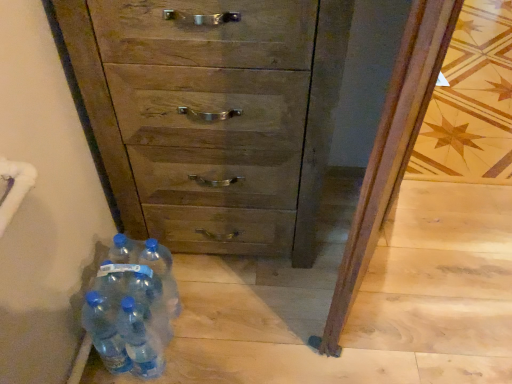
What do you see at coordinates (212, 92) in the screenshot? The image size is (512, 384). I see `wooden chest of drawers at center` at bounding box center [212, 92].

The height and width of the screenshot is (384, 512). What do you see at coordinates (150, 300) in the screenshot? I see `transparent plastic bottles at lower left, the fourth bottle viewed from the left` at bounding box center [150, 300].

In order to face translucent plastic water bottles at lower left, acting as the fifth bottle starting from the right, should I rotate leftwards or rightwards?

You should rotate left by 19.321 degrees.

Describe the element at coordinates (105, 333) in the screenshot. The image size is (512, 384). I see `translucent plastic water bottles at lower left, acting as the fifth bottle starting from the right` at that location.

How much space does blue plastic bottles at lower left, the 4th bottle in the right-to-left sequence, occupy horizontally?

The width of blue plastic bottles at lower left, the 4th bottle in the right-to-left sequence, is 3.86 inches.

The image size is (512, 384). Identify the location of blue plastic bottles at lower left, marked as the 2th bottle in a left-to-right arrangement. (133, 312).

You are a GUI agent. You are given a task and a screenshot of the screen. Output one action in this format:
    pyautogui.click(x=<x>, y=<y>)
    Task: Click on the transparent plastic bottles at lower left, arranged as the third bottle when viewed from the left
    This screenshot has height=384, width=512.
    Given the screenshot: What is the action you would take?
    coord(140,339)

The width and height of the screenshot is (512, 384). I want to click on wooden chest of drawers at center, so (x=212, y=92).

Could you tell me if wooden chest of drawers at center is facing blue plastic bottles at lower left, the 4th bottle in the right-to-left sequence?

Yes, wooden chest of drawers at center is turned towards blue plastic bottles at lower left, the 4th bottle in the right-to-left sequence.

Considering the positions of points (193, 201) and (133, 294), is point (193, 201) closer to camera compared to point (133, 294)?

That is False.

From the image's perspective, is wooden chest of drawers at center on top of blue plastic bottles at lower left, the 4th bottle in the right-to-left sequence?

Yes, from the image's perspective, wooden chest of drawers at center is on top of blue plastic bottles at lower left, the 4th bottle in the right-to-left sequence.

Which of these two, blue plastic bottles at lower left, marked as the 2th bottle in a left-to-right arrangement, or blue translucent bottle at lower left, acting as the 1th bottle starting from the right, is smaller?

Smaller between the two is blue translucent bottle at lower left, acting as the 1th bottle starting from the right.

Between blue plastic bottles at lower left, the 4th bottle in the right-to-left sequence, and blue translucent bottle at lower left, acting as the 1th bottle starting from the right, which one appears on the right side from the viewer's perspective?

Positioned to the right is blue translucent bottle at lower left, acting as the 1th bottle starting from the right.

Is blue plastic bottles at lower left, marked as the 2th bottle in a left-to-right arrangement, looking in the opposite direction of blue translucent bottle at lower left, the fifth bottle positioned from the left?

That's not correct — blue plastic bottles at lower left, marked as the 2th bottle in a left-to-right arrangement, is not looking away from blue translucent bottle at lower left, the fifth bottle positioned from the left.

Is blue plastic bottles at lower left, the 4th bottle in the right-to-left sequence, taller than blue translucent bottle at lower left, the fifth bottle positioned from the left?

Indeed, blue plastic bottles at lower left, the 4th bottle in the right-to-left sequence, has a greater height compared to blue translucent bottle at lower left, the fifth bottle positioned from the left.

From a real-world perspective, is blue translucent bottle at lower left, the fifth bottle positioned from the left, physically above wooden chest of drawers at center?

No.

From the image's perspective, is blue translucent bottle at lower left, the fifth bottle positioned from the left, positioned above or below wooden chest of drawers at center?

Clearly, from the image's perspective, blue translucent bottle at lower left, the fifth bottle positioned from the left, is below wooden chest of drawers at center.

Does point (161, 251) come farther from viewer compared to point (101, 116)?

Yes, it is behind point (101, 116).

Considering the positions of objects blue translucent bottle at lower left, the fifth bottle positioned from the left, and wooden chest of drawers at center in the image provided, who is more to the left, blue translucent bottle at lower left, the fifth bottle positioned from the left, or wooden chest of drawers at center?

Positioned to the left is blue translucent bottle at lower left, the fifth bottle positioned from the left.

Is translucent plastic water bottles at lower left, the first bottle when ordered from left to right, positioned with its back to transparent plastic bottles at lower left, arranged as the third bottle when viewed from the left?

Yes, translucent plastic water bottles at lower left, the first bottle when ordered from left to right, is positioned with its back facing transparent plastic bottles at lower left, arranged as the third bottle when viewed from the left.

Consider the image. Between translucent plastic water bottles at lower left, the first bottle when ordered from left to right, and transparent plastic bottles at lower left, acting as the 3th bottle starting from the right, which one has smaller size?

Smaller between the two is translucent plastic water bottles at lower left, the first bottle when ordered from left to right.

Can you confirm if translucent plastic water bottles at lower left, the first bottle when ordered from left to right, is shorter than transparent plastic bottles at lower left, arranged as the third bottle when viewed from the left?

Yes, translucent plastic water bottles at lower left, the first bottle when ordered from left to right, is shorter than transparent plastic bottles at lower left, arranged as the third bottle when viewed from the left.

Is the surface of blue plastic bottles at lower left, marked as the 2th bottle in a left-to-right arrangement, in direct contact with wooden chest of drawers at center?

No, blue plastic bottles at lower left, marked as the 2th bottle in a left-to-right arrangement, is not touching wooden chest of drawers at center.

From a real-world perspective, does blue plastic bottles at lower left, the 4th bottle in the right-to-left sequence, sit lower than wooden chest of drawers at center?

Indeed, from a real-world perspective, blue plastic bottles at lower left, the 4th bottle in the right-to-left sequence, is positioned beneath wooden chest of drawers at center.

Considering the relative sizes of blue plastic bottles at lower left, the 4th bottle in the right-to-left sequence, and wooden chest of drawers at center in the image provided, is blue plastic bottles at lower left, the 4th bottle in the right-to-left sequence, wider than wooden chest of drawers at center?

No, blue plastic bottles at lower left, the 4th bottle in the right-to-left sequence, is not wider than wooden chest of drawers at center.

From the image's perspective, does blue plastic bottles at lower left, marked as the 2th bottle in a left-to-right arrangement, appear higher than wooden chest of drawers at center?

Incorrect, from the image's perspective, blue plastic bottles at lower left, marked as the 2th bottle in a left-to-right arrangement, is lower than wooden chest of drawers at center.

Consider the image. Does transparent plastic bottles at lower left, arranged as the third bottle when viewed from the left, lie behind blue translucent bottle at lower left, the fifth bottle positioned from the left?

That is False.

Is transparent plastic bottles at lower left, arranged as the third bottle when viewed from the left, bigger or smaller than blue translucent bottle at lower left, acting as the 1th bottle starting from the right?

Clearly, transparent plastic bottles at lower left, arranged as the third bottle when viewed from the left, is smaller in size than blue translucent bottle at lower left, acting as the 1th bottle starting from the right.

Is transparent plastic bottles at lower left, acting as the 3th bottle starting from the right, wider or thinner than blue translucent bottle at lower left, the fifth bottle positioned from the left?

transparent plastic bottles at lower left, acting as the 3th bottle starting from the right, is thinner than blue translucent bottle at lower left, the fifth bottle positioned from the left.

Is transparent plastic bottles at lower left, acting as the 3th bottle starting from the right, aimed at blue translucent bottle at lower left, the fifth bottle positioned from the left?

No, transparent plastic bottles at lower left, acting as the 3th bottle starting from the right, does not turn towards blue translucent bottle at lower left, the fifth bottle positioned from the left.

Is blue plastic bottles at lower left, the 4th bottle in the right-to-left sequence, positioned beyond the bounds of translucent plastic water bottles at lower left, acting as the fifth bottle starting from the right?

blue plastic bottles at lower left, the 4th bottle in the right-to-left sequence, is positioned outside translucent plastic water bottles at lower left, acting as the fifth bottle starting from the right.

Considering the positions of objects blue plastic bottles at lower left, marked as the 2th bottle in a left-to-right arrangement, and translucent plastic water bottles at lower left, acting as the fifth bottle starting from the right, in the image provided, who is more to the left, blue plastic bottles at lower left, marked as the 2th bottle in a left-to-right arrangement, or translucent plastic water bottles at lower left, acting as the fifth bottle starting from the right,?

Positioned to the left is translucent plastic water bottles at lower left, acting as the fifth bottle starting from the right.

Does point (170, 329) come closer to viewer compared to point (102, 338)?

No, (170, 329) is further to viewer.

Locate an element on the screen. The width and height of the screenshot is (512, 384). chest of drawers to the right of blue plastic bottles at lower left, the 4th bottle in the right-to-left sequence is located at coordinates (212, 92).

From the image's perspective, which bottle is the 1st one below the blue translucent bottle at lower left, the fifth bottle positioned from the left? Please provide its 2D coordinates.

[(133, 312)]

Which object lies further to the anchor point blue plastic bottles at lower left, marked as the 2th bottle in a left-to-right arrangement, translucent plastic water bottles at lower left, acting as the fifth bottle starting from the right, or transparent plastic bottles at lower left, the second bottle viewed from the right?

translucent plastic water bottles at lower left, acting as the fifth bottle starting from the right, lies further to blue plastic bottles at lower left, marked as the 2th bottle in a left-to-right arrangement, than the other object.

Considering their positions, is blue plastic bottles at lower left, the 4th bottle in the right-to-left sequence, positioned closer to blue translucent bottle at lower left, the fifth bottle positioned from the left, than transparent plastic bottles at lower left, the fourth bottle viewed from the left?

transparent plastic bottles at lower left, the fourth bottle viewed from the left, lies closer to blue translucent bottle at lower left, the fifth bottle positioned from the left, than the other object.

Which object lies nearer to the anchor point blue plastic bottles at lower left, the 4th bottle in the right-to-left sequence, wooden chest of drawers at center or transparent plastic bottles at lower left, arranged as the third bottle when viewed from the left?

transparent plastic bottles at lower left, arranged as the third bottle when viewed from the left, is closer to blue plastic bottles at lower left, the 4th bottle in the right-to-left sequence.

When comparing their distances from blue translucent bottle at lower left, acting as the 1th bottle starting from the right, does translucent plastic water bottles at lower left, acting as the fifth bottle starting from the right, or transparent plastic bottles at lower left, arranged as the third bottle when viewed from the left, seem closer?

transparent plastic bottles at lower left, arranged as the third bottle when viewed from the left, is positioned closer to the anchor blue translucent bottle at lower left, acting as the 1th bottle starting from the right.

Which object lies further to the anchor point blue plastic bottles at lower left, the 4th bottle in the right-to-left sequence, blue translucent bottle at lower left, acting as the 1th bottle starting from the right, or wooden chest of drawers at center?

wooden chest of drawers at center is further to blue plastic bottles at lower left, the 4th bottle in the right-to-left sequence.

Based on their spatial positions, is wooden chest of drawers at center or transparent plastic bottles at lower left, arranged as the third bottle when viewed from the left, further from translucent plastic water bottles at lower left, the first bottle when ordered from left to right?

Based on the image, wooden chest of drawers at center appears to be further to translucent plastic water bottles at lower left, the first bottle when ordered from left to right.

When comparing their distances from transparent plastic bottles at lower left, the second bottle viewed from the right, does transparent plastic bottles at lower left, acting as the 3th bottle starting from the right, or translucent plastic water bottles at lower left, the first bottle when ordered from left to right, seem closer?

transparent plastic bottles at lower left, acting as the 3th bottle starting from the right, lies closer to transparent plastic bottles at lower left, the second bottle viewed from the right, than the other object.

Which object lies nearer to the anchor point wooden chest of drawers at center, blue plastic bottles at lower left, marked as the 2th bottle in a left-to-right arrangement, or transparent plastic bottles at lower left, acting as the 3th bottle starting from the right?

blue plastic bottles at lower left, marked as the 2th bottle in a left-to-right arrangement, is closer to wooden chest of drawers at center.

Find the location of a particular element. bottle situated between translucent plastic water bottles at lower left, the first bottle when ordered from left to right, and transparent plastic bottles at lower left, acting as the 3th bottle starting from the right, from left to right is located at coordinates (133, 312).

At what (x,y) coordinates should I click in order to perform the action: click on bottle between wooden chest of drawers at center and blue plastic bottles at lower left, marked as the 2th bottle in a left-to-right arrangement, in the vertical direction. Please return your answer as a coordinate pair (x, y). Looking at the image, I should click on (162, 272).